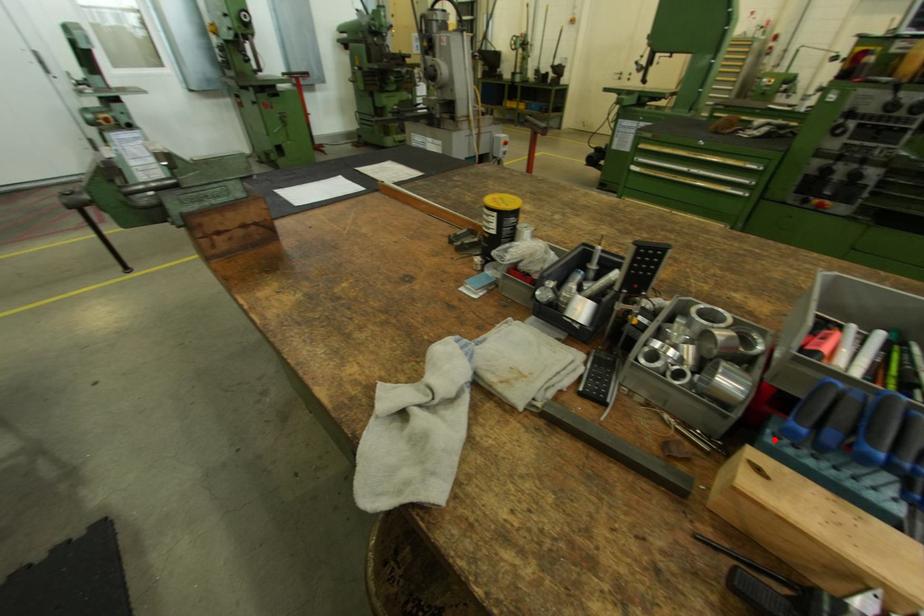
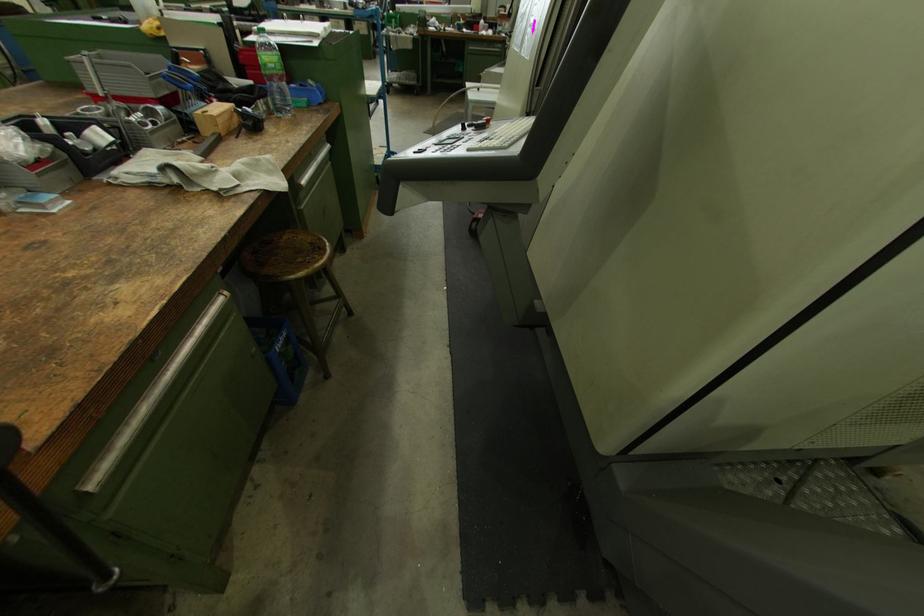
In the second image, find the point that corresponds to the highlighted location in the first image.

(192, 113)